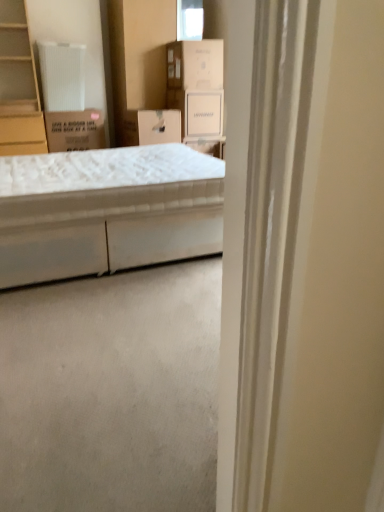
Question: From the image's perspective, is white cardboard box at upper center, which appears as the 2th storage box when viewed from the left, beneath brown cardboard box at upper left, which is counted as the first cardboard box, starting from the left?

Choices:
 (A) no
 (B) yes

Answer: (A)

Question: From a real-world perspective, is white cardboard box at upper center, which appears as the 2th storage box when viewed from the left, located beneath brown cardboard box at upper left, the second cardboard box positioned from the top?

Choices:
 (A) yes
 (B) no

Answer: (B)

Question: Is white cardboard box at upper center, which appears as the 1th storage box when viewed from the right, thinner than brown cardboard box at upper left, which is counted as the first cardboard box, starting from the left?

Choices:
 (A) no
 (B) yes

Answer: (B)

Question: Does white cardboard box at upper center, which appears as the 1th storage box when viewed from the right, come behind brown cardboard box at upper left, which is counted as the first cardboard box, starting from the left?

Choices:
 (A) no
 (B) yes

Answer: (B)

Question: Can you confirm if white cardboard box at upper center, which appears as the 1th storage box when viewed from the right, is shorter than brown cardboard box at upper left, the second cardboard box positioned from the top?

Choices:
 (A) no
 (B) yes

Answer: (A)

Question: Choose the correct answer: Is brown cardboard box at upper left, marked as the second cardboard box in a right-to-left arrangement, inside white cardboard box at upper center, which appears as the 2th storage box when viewed from the left, or outside it?

Choices:
 (A) inside
 (B) outside

Answer: (B)

Question: In terms of width, does brown cardboard box at upper left, marked as the second cardboard box in a right-to-left arrangement, look wider or thinner when compared to white cardboard box at upper center, which appears as the 1th storage box when viewed from the right?

Choices:
 (A) thin
 (B) wide

Answer: (B)

Question: Is point (67, 139) positioned closer to the camera than point (215, 106)?

Choices:
 (A) closer
 (B) farther

Answer: (A)

Question: Relative to white cardboard box at upper center, which appears as the 1th storage box when viewed from the right, is brown cardboard box at upper left, which is counted as the first cardboard box, starting from the left, in front or behind?

Choices:
 (A) front
 (B) behind

Answer: (A)

Question: Would you say white cardboard box at upper center, which appears as the 2th storage box when viewed from the left, is inside or outside white fabric bed at center?

Choices:
 (A) inside
 (B) outside

Answer: (B)

Question: From a real-world perspective, is white cardboard box at upper center, which appears as the 1th storage box when viewed from the right, positioned above or below white fabric bed at center?

Choices:
 (A) above
 (B) below

Answer: (A)

Question: Is white cardboard box at upper center, which appears as the 1th storage box when viewed from the right, to the left or to the right of white fabric bed at center in the image?

Choices:
 (A) left
 (B) right

Answer: (B)

Question: Relative to white fabric bed at center, is white cardboard box at upper center, which appears as the 1th storage box when viewed from the right, in front or behind?

Choices:
 (A) behind
 (B) front

Answer: (A)

Question: Is brown cardboard box at upper left, which is counted as the first cardboard box, starting from the left, taller or shorter than white cardboard box at center, which is the 2th storage box in right-to-left order?

Choices:
 (A) tall
 (B) short

Answer: (A)

Question: Would you say brown cardboard box at upper left, which is counted as the first cardboard box, starting from the left, is to the left or to the right of white cardboard box at center, the first storage box from the left, in the picture?

Choices:
 (A) right
 (B) left

Answer: (B)